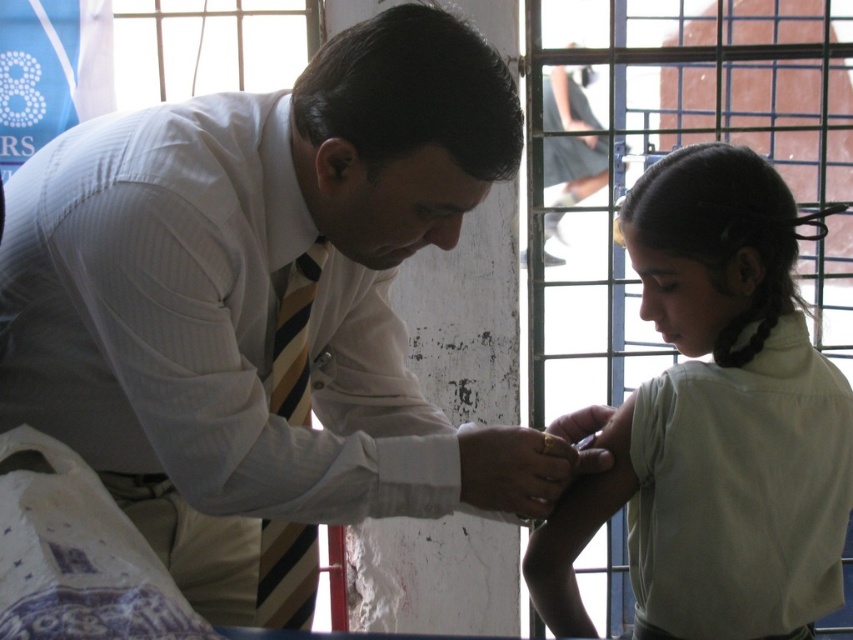
You are a fashion designer observing the scene. You need to determine which object, the striped fabric tie at left or the gold ring at upper center, would require more fabric to create. Based on the description, which one would you choose?

The striped fabric tie at left has a larger size compared to the gold ring at upper center, so it would require more fabric to create.

You are a medical student observing a vaccination procedure. You notice the light beige shirt at right and the striped fabric tie at left. Which object is closer to you?

The light beige shirt at right is closer to you because it is further to the viewer than the striped fabric tie at left.

You are standing at the point labeled point (177,179) in a medical facility. A nurse needs to place a small medical kit on the floor exactly where you are standing. However, there is a 1.2 meter wide medical cart parked 1 meter away from your current position. Can the nurse safely place the kit without it being obstructed by the cart?

The point labeled point (177,179) is 1.41 meters away from the viewer. The medical cart is parked 1 meter away, which is closer than the point. Therefore, placing the kit at the specified point may result in obstruction by the cart since the cart is between the viewer and the point.